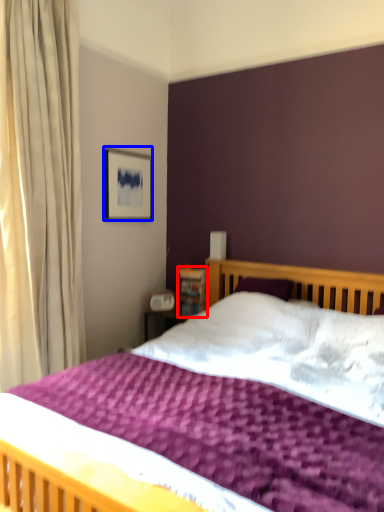
Question: Which object is closer to the camera taking this photo, bookshelf (highlighted by a red box) or picture frame (highlighted by a blue box)?

Choices:
 (A) bookshelf
 (B) picture frame

Answer: (B)